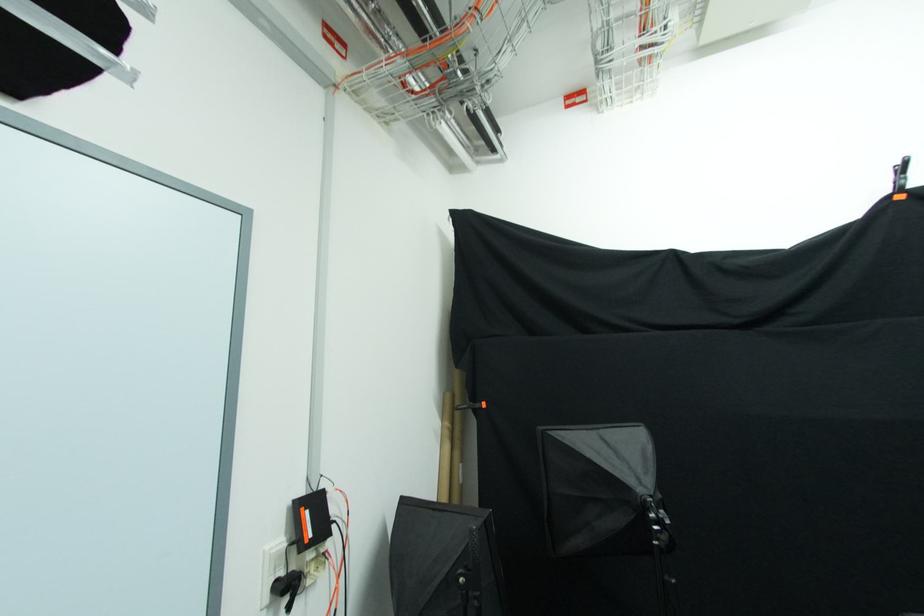
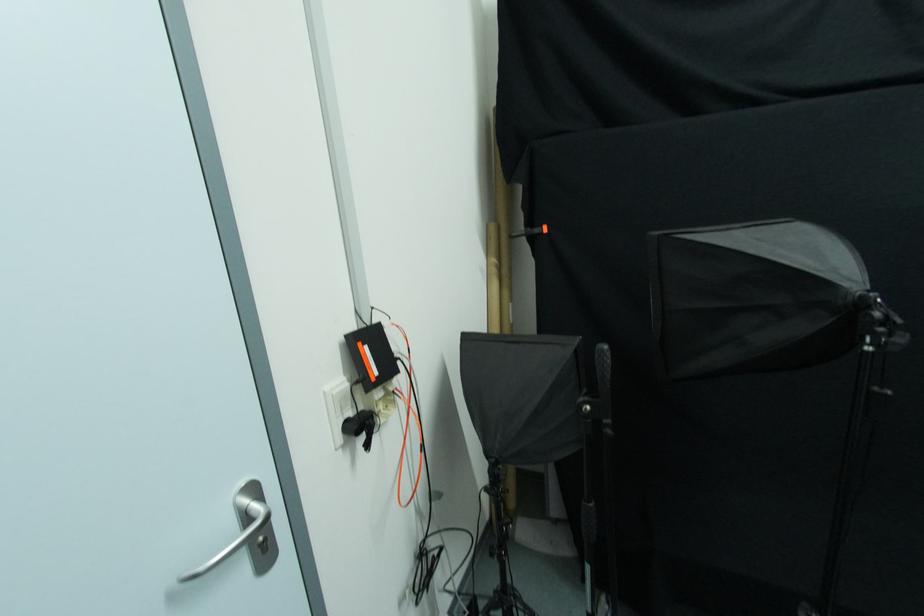
Which direction would the cameraman need to move to produce the second image?

The cameraman walked toward left, forward.